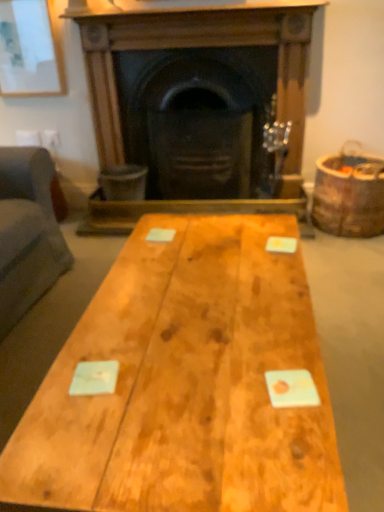
Locate an element on the screen. The height and width of the screenshot is (512, 384). free space above wooden fireplace at center (from a real-world perspective) is located at coordinates (193, 18).